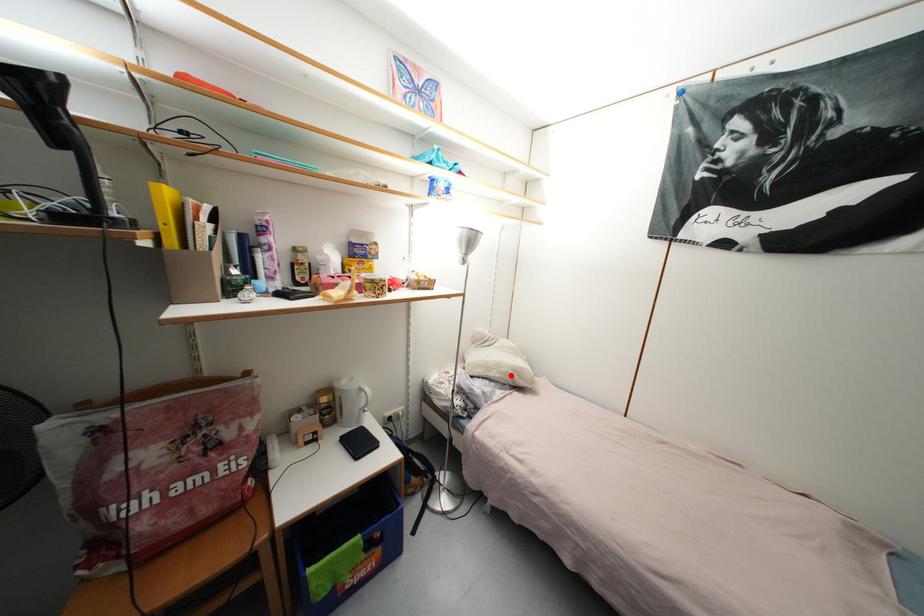
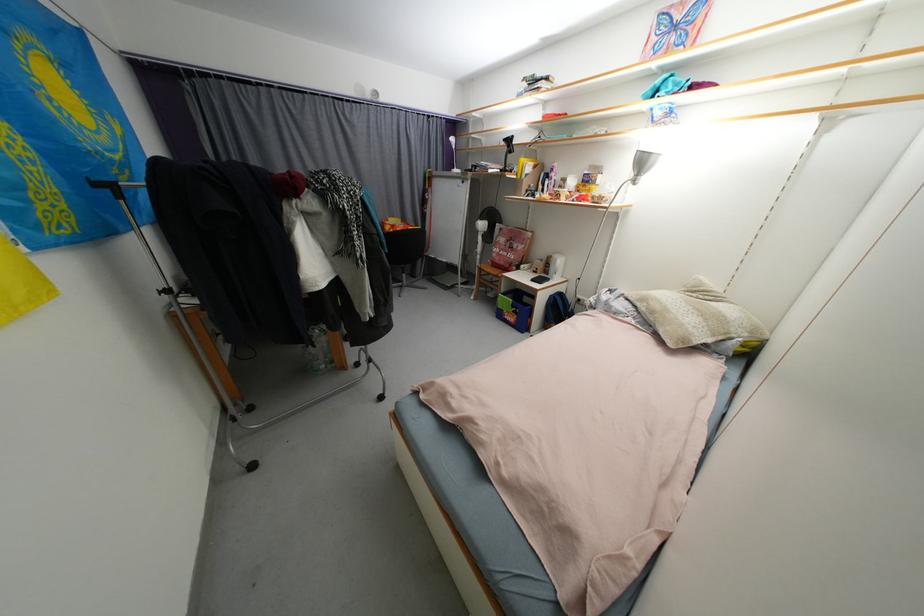
Where in the second image is the point corresponding to the highlighted location from the first image?

(658, 314)